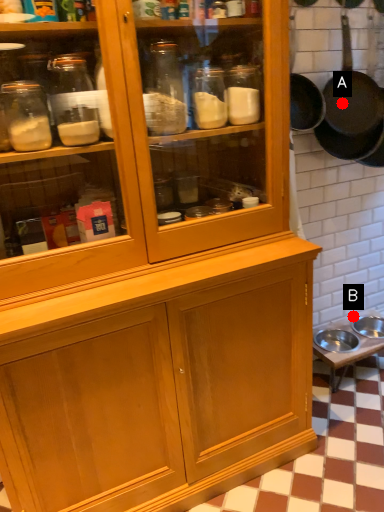
Question: Two points are circled on the image, labeled by A and B beside each circle. Which of the following is the closest to the observer?

Choices:
 (A) A is closer
 (B) B is closer

Answer: (A)